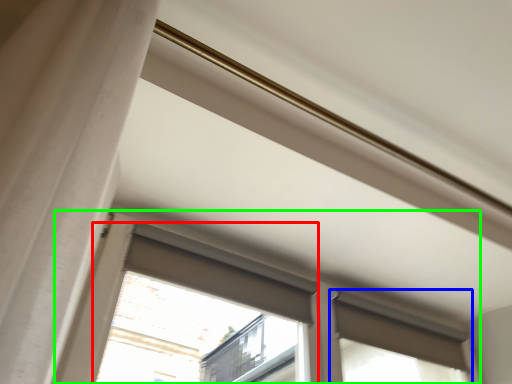
Question: Which is nearer to the bay window (highlighted by a red box)? window (highlighted by a blue box) or window (highlighted by a green box).

Choices:
 (A) window
 (B) window

Answer: (A)